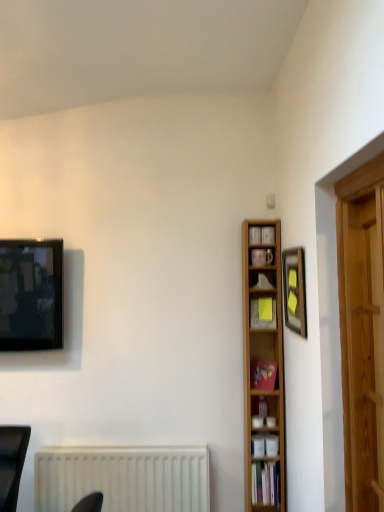
Question: Which is correct: wooden bookcase at right is inside matte yellow sticky note at center-right, which is the 1th book in top-to-bottom order, or outside of it?

Choices:
 (A) outside
 (B) inside

Answer: (A)

Question: From a real-world perspective, is wooden bookcase at right physically located above or below matte yellow sticky note at center-right, arranged as the third book when ordered from the bottom?

Choices:
 (A) below
 (B) above

Answer: (A)

Question: Considering the real-world distances, which object is closest to the hardcover book at lower center, positioned as the first book in bottom-to-top order?

Choices:
 (A) matte yellow sticky note at center-right, arranged as the third book when ordered from the bottom
 (B) wooden framed picture at upper right
 (C) matte black television at upper left
 (D) matte red book at center-right, the 2th book from the bottom
 (E) wooden bookcase at right

Answer: (E)

Question: Which is nearer to the wooden bookcase at right?

Choices:
 (A) hardcover book at lower center, positioned as the first book in bottom-to-top order
 (B) matte yellow sticky note at center-right, which is the 1th book in top-to-bottom order
 (C) matte black television at upper left
 (D) matte red book at center-right, marked as the second book in a top-to-bottom arrangement
 (E) wooden framed picture at upper right

Answer: (D)